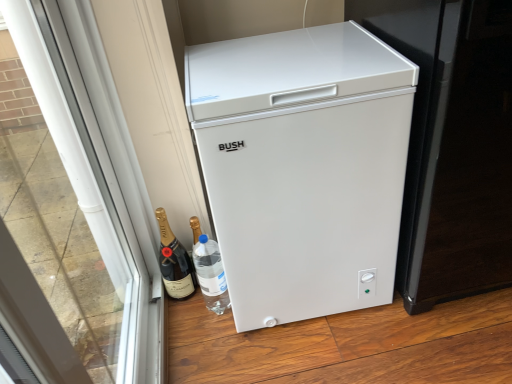
Question: Is white matte refrigerator at center at the back of black glass bottle at lower left?

Choices:
 (A) yes
 (B) no

Answer: (B)

Question: Does black glass bottle at lower left come behind white matte refrigerator at center?

Choices:
 (A) no
 (B) yes

Answer: (B)

Question: Does black glass bottle at lower left appear on the left side of white matte refrigerator at center?

Choices:
 (A) no
 (B) yes

Answer: (B)

Question: Is black glass bottle at lower left wider than white matte refrigerator at center?

Choices:
 (A) no
 (B) yes

Answer: (A)

Question: Is black glass bottle at lower left in front of white matte refrigerator at center?

Choices:
 (A) no
 (B) yes

Answer: (A)

Question: From the image's perspective, is white matte refrigerator at center positioned above or below black glass bottle at lower left?

Choices:
 (A) above
 (B) below

Answer: (A)

Question: Looking at the image, does white matte refrigerator at center seem bigger or smaller compared to black glass bottle at lower left?

Choices:
 (A) small
 (B) big

Answer: (B)

Question: Does point (279, 193) appear closer or farther from the camera than point (175, 258)?

Choices:
 (A) closer
 (B) farther

Answer: (A)

Question: From a real-world perspective, is white matte refrigerator at center above or below black glass bottle at lower left?

Choices:
 (A) below
 (B) above

Answer: (B)

Question: Is point (437, 130) positioned closer to the camera than point (386, 134)?

Choices:
 (A) farther
 (B) closer

Answer: (A)

Question: From their relative heights in the image, would you say white plastic freezer at right is taller or shorter than white matte refrigerator at center?

Choices:
 (A) short
 (B) tall

Answer: (B)

Question: Considering their positions, is white plastic freezer at right located in front of or behind white matte refrigerator at center?

Choices:
 (A) behind
 (B) front

Answer: (B)

Question: Do you think white plastic freezer at right is within white matte refrigerator at center, or outside of it?

Choices:
 (A) outside
 (B) inside

Answer: (A)

Question: Considering the positions of white matte refrigerator at center and transparent glass door at left in the image, is white matte refrigerator at center wider or thinner than transparent glass door at left?

Choices:
 (A) thin
 (B) wide

Answer: (B)

Question: Is white matte refrigerator at center to the left or to the right of transparent glass door at left in the image?

Choices:
 (A) left
 (B) right

Answer: (B)